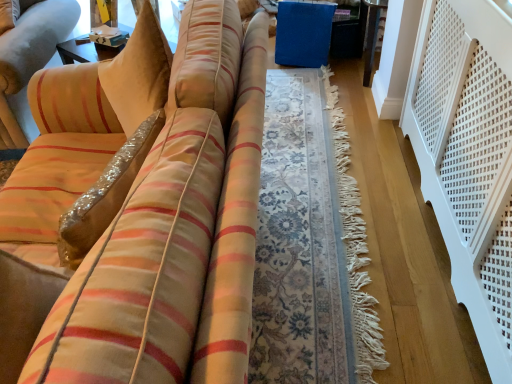
Question: Considering the positions of point coord(67,44) and point coord(475,304), is point coord(67,44) closer or farther from the camera than point coord(475,304)?

Choices:
 (A) closer
 (B) farther

Answer: (B)

Question: Choose the correct answer: Is white cardboard box at upper left inside white perforated balustrade at right or outside it?

Choices:
 (A) outside
 (B) inside

Answer: (A)

Question: Is white cardboard box at upper left in front of or behind white perforated balustrade at right in the image?

Choices:
 (A) behind
 (B) front

Answer: (A)

Question: Based on their sizes in the image, would you say white perforated balustrade at right is bigger or smaller than white cardboard box at upper left?

Choices:
 (A) big
 (B) small

Answer: (A)

Question: Do you think white perforated balustrade at right is within white cardboard box at upper left, or outside of it?

Choices:
 (A) inside
 (B) outside

Answer: (B)

Question: From the image's perspective, is white perforated balustrade at right positioned above or below white cardboard box at upper left?

Choices:
 (A) above
 (B) below

Answer: (B)

Question: Would you say white perforated balustrade at right is to the left or to the right of white cardboard box at upper left in the picture?

Choices:
 (A) left
 (B) right

Answer: (B)